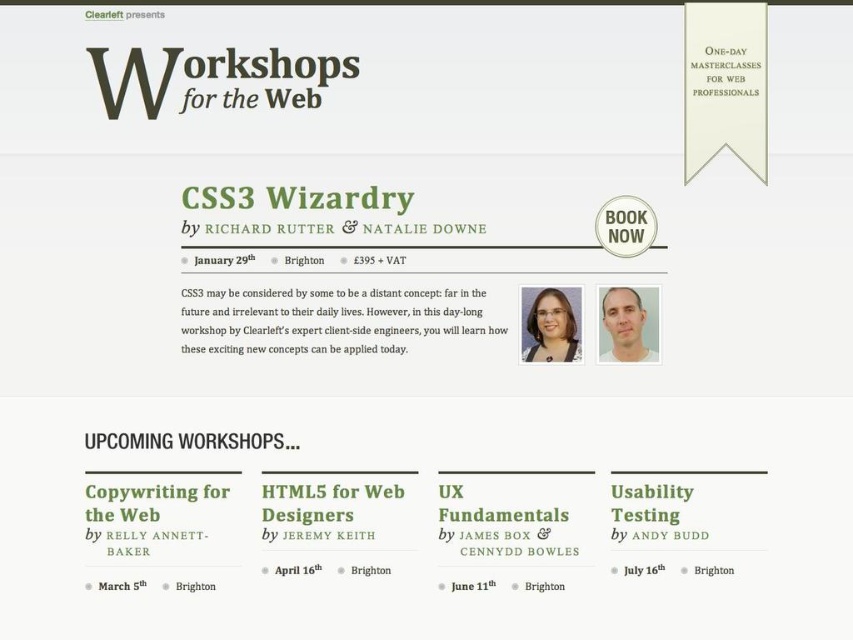
Can you confirm if black paper text at center is positioned to the left of black text at center?

Incorrect, black paper text at center is not on the left side of black text at center.

Consider the image. Between black paper text at center and black text at center, which one has more height?

black paper text at center is taller.

Between point (343, 333) and point (276, 445), which one is positioned behind?

Positioned behind is point (343, 333).

Find the location of a particular element. This screenshot has width=853, height=640. black paper text at center is located at coordinates (328, 326).

Between black paper text at center and greentextured paperdate at center, which one has less height?

Standing shorter between the two is greentextured paperdate at center.

Can you confirm if black paper text at center is positioned below greentextured paperdate at center?

Incorrect, black paper text at center is not positioned below greentextured paperdate at center.

Who is more forward, (x=363, y=298) or (x=490, y=588)?

Positioned in front is point (x=490, y=588).

At what (x,y) coordinates should I click in order to perform the action: click on black paper text at center. Please return your answer as a coordinate pair (x, y). This screenshot has width=853, height=640. Looking at the image, I should click on (328, 326).

Which is below, white paper at upper right or black text at center?

black text at center

Does white paper at upper right appear on the right side of black text at center?

Indeed, white paper at upper right is positioned on the right side of black text at center.

Identify the location of white paper at upper right. (724, 68).